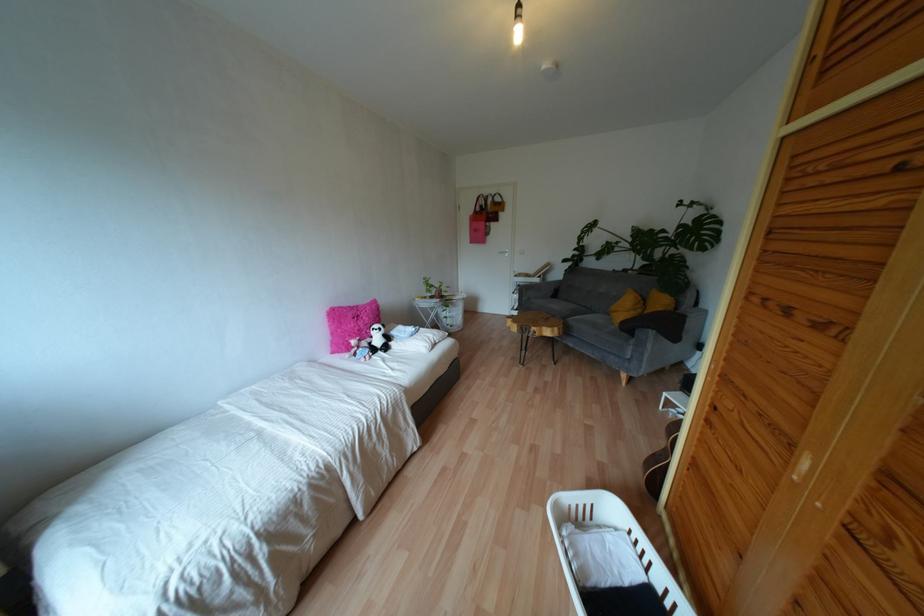
At what (x,y) coordinates should I click in order to perform the action: click on gray sofa armrest. Please return your answer as a coordinate pair (x, y). Looking at the image, I should click on (687, 326).